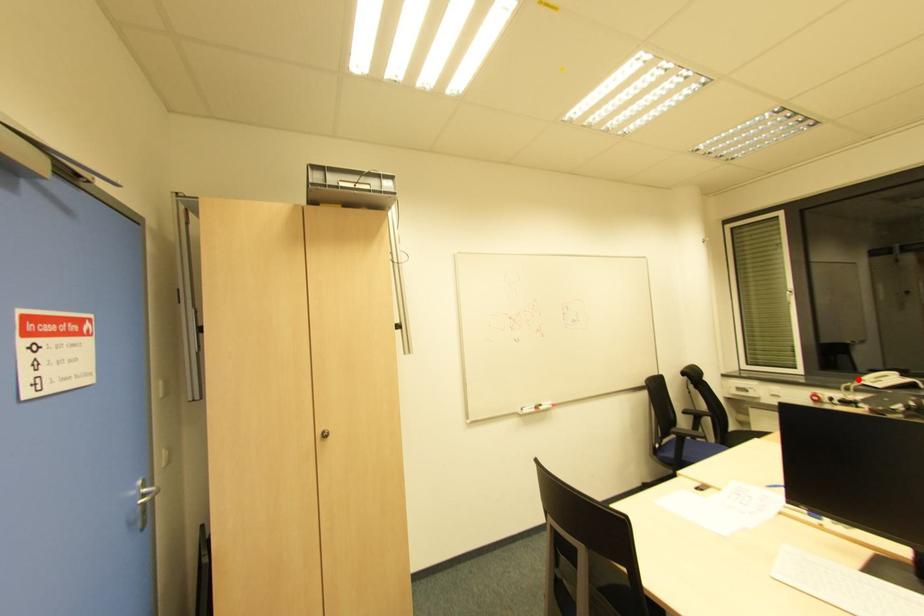
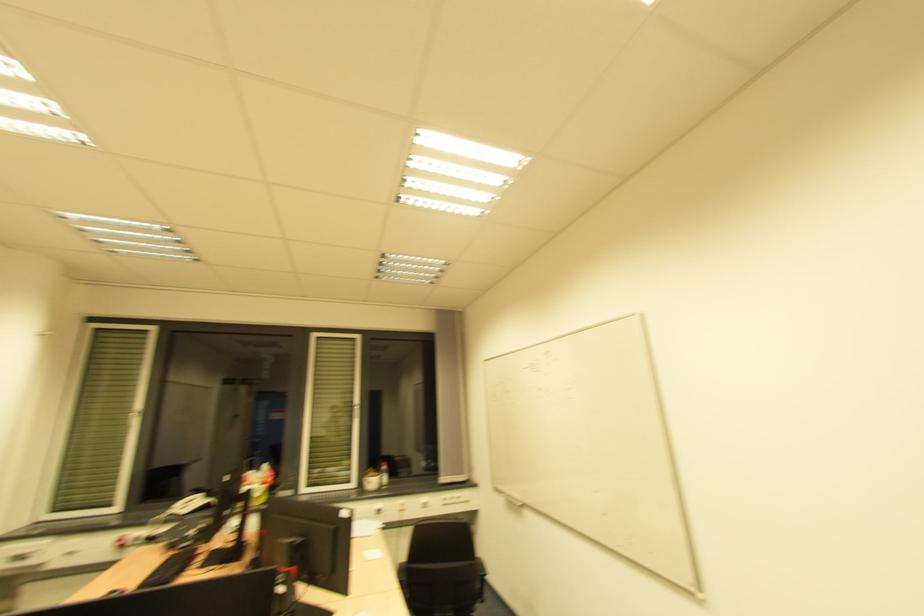
The point at the highlighted location is marked in the first image. Where is the corresponding point in the second image?

(169, 509)